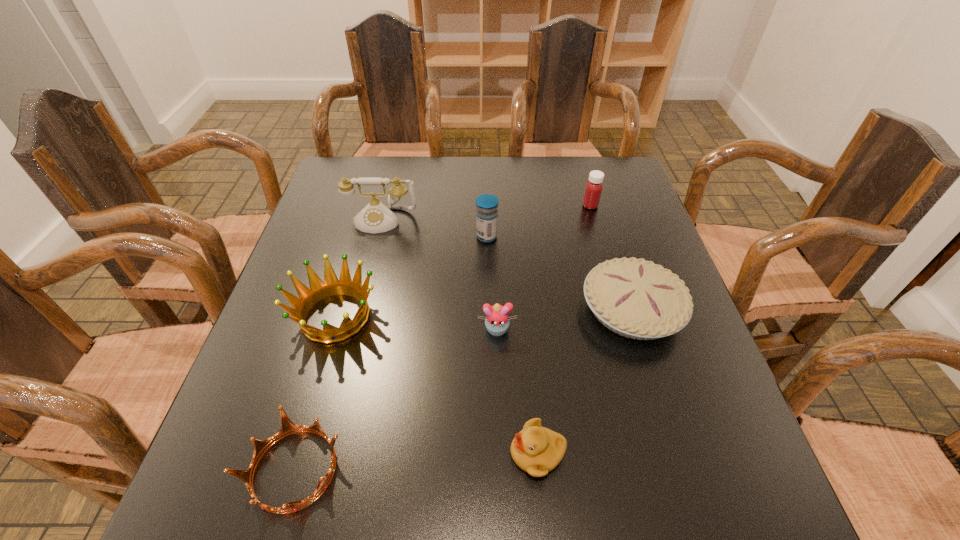
In order to click on vacant area between the telephone and the left medicine in this screenshot , I will do `click(434, 228)`.

Identify the location of object that is the second nearest to the cupcake. Image resolution: width=960 pixels, height=540 pixels. (537, 450).

Where is `object that stands as the third closest to the left medicine`? The image size is (960, 540). object that stands as the third closest to the left medicine is located at coordinates (497, 321).

What are the coordinates of `vacant area in the image that satisfies the following two spatial constraints: 1. on the back side of the taller crown; 2. on the right side of the left medicine` in the screenshot? It's located at (358, 237).